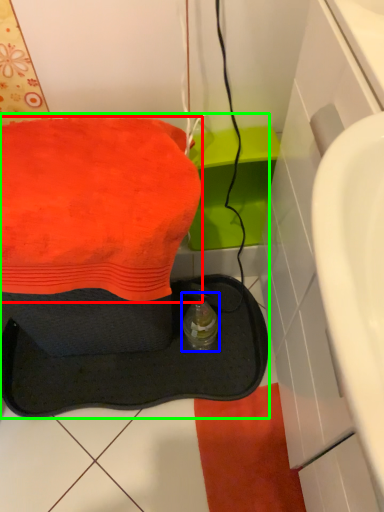
Question: Which object is the closest to the towel (highlighted by a red box)? Choose among these: bottle (highlighted by a blue box) or sink (highlighted by a green box).

Choices:
 (A) bottle
 (B) sink

Answer: (A)